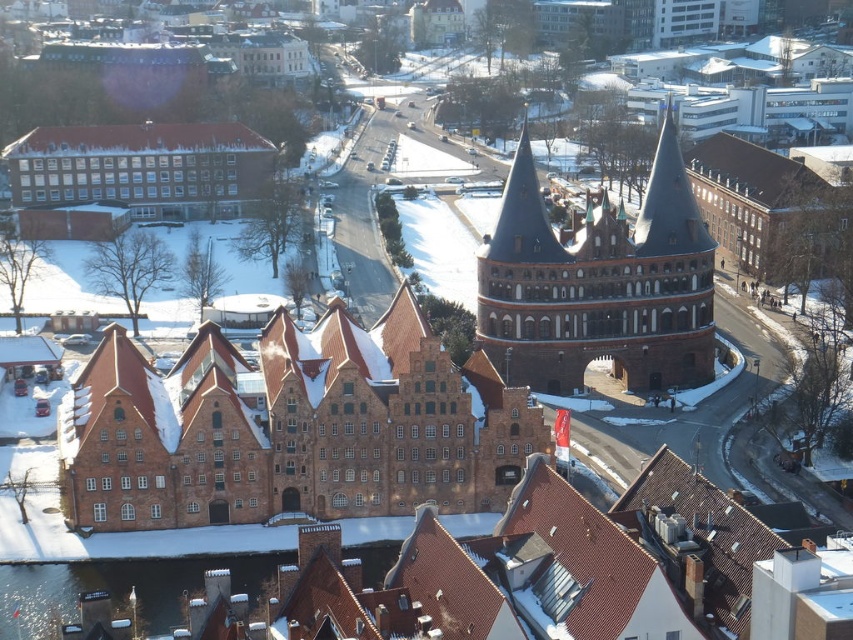
Question: Which object is closer to the camera taking this photo?

Choices:
 (A) brown brick building at center
 (B) brown stone tower at center

Answer: (A)

Question: Is brown brick building at center further to camera compared to brown stone tower at center?

Choices:
 (A) no
 (B) yes

Answer: (A)

Question: Which of the following is the farthest from the observer?

Choices:
 (A) (595, 224)
 (B) (235, 348)

Answer: (A)

Question: Can you confirm if brown brick building at center is smaller than brown stone tower at center?

Choices:
 (A) yes
 (B) no

Answer: (A)

Question: Is brown brick building at center closer to the viewer compared to brown stone tower at center?

Choices:
 (A) yes
 (B) no

Answer: (A)

Question: Among these objects, which one is farthest from the camera?

Choices:
 (A) brown brick building at center
 (B) brown stone tower at center

Answer: (B)